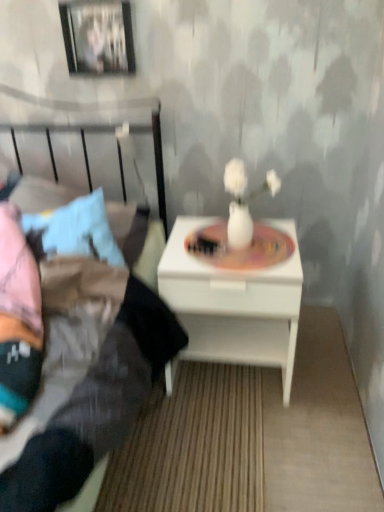
In order to click on free spot below white glossy nightstand at center (from a real-world perspective) in this screenshot , I will do `click(236, 378)`.